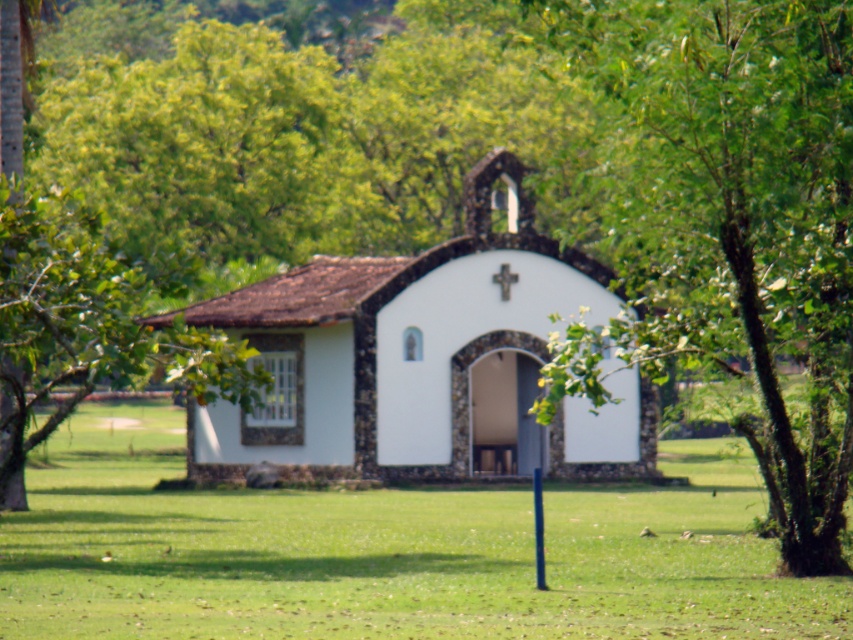
You are a gardener who wants to mow the green grass at center near the white stucco church at center. Which one is closer to the ground?

The green grass at center is shorter than the white stucco church at center, so the green grass at center is closer to the ground.

You are standing in a field and see the green grass at center and the white stucco church at center. Which one appears wider from your perspective?

The green grass at center appears wider than the white stucco church at center because its width is larger.

Looking at this image, you are standing in front of the chapel and want to take a photo. There are two points marked on the chapel wall at coordinates point (56, 598) and point (402, 436). Which point is closer to your current position?

Point (56, 598) is closer to the camera than point (402, 436), so the point (56, 598) is closer to your current position.